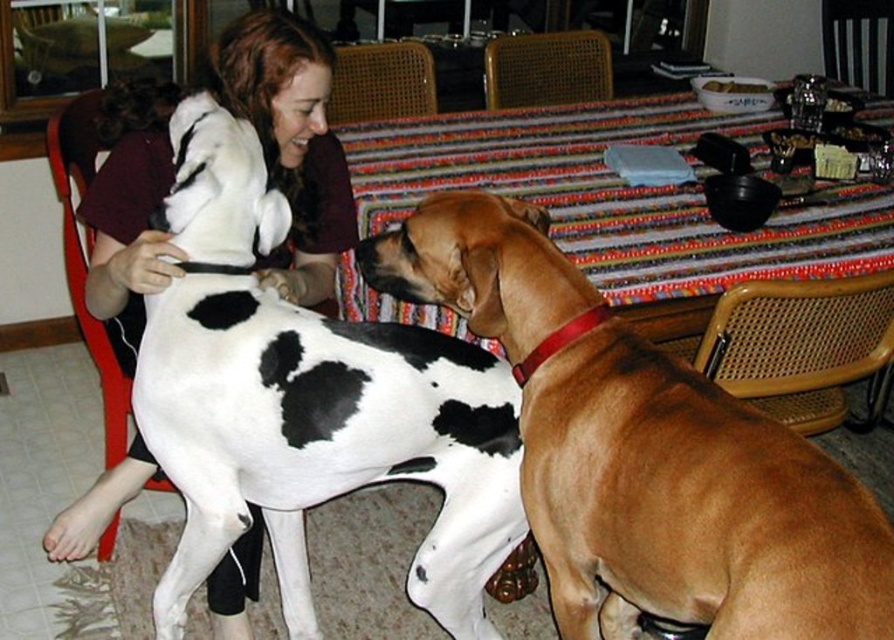
Is white-spotted fur dog at center smaller than matte black shirt at upper left?

No, white-spotted fur dog at center is not smaller than matte black shirt at upper left.

Between white-spotted fur dog at center and matte black shirt at upper left, which one has more height?

white-spotted fur dog at center

Is point (196, 394) farther from camera compared to point (285, 148)?

No, (196, 394) is in front of (285, 148).

This screenshot has width=894, height=640. Find the location of `white-spotted fur dog at center`. white-spotted fur dog at center is located at coordinates (308, 403).

Does striped fabric table at center have a larger size compared to matte black shirt at upper left?

Answer: Yes.

Does point (833, 195) come behind point (233, 74)?

Yes, it is.

The width and height of the screenshot is (894, 640). I want to click on striped fabric table at center, so click(628, 195).

Who is positioned more to the left, matte black shirt at upper left or braided wood chair at lower right?

From the viewer's perspective, matte black shirt at upper left appears more on the left side.

Who is lower down, matte black shirt at upper left or braided wood chair at lower right?

braided wood chair at lower right is lower down.

Locate an element on the screen. The height and width of the screenshot is (640, 894). matte black shirt at upper left is located at coordinates (291, 141).

Image resolution: width=894 pixels, height=640 pixels. In order to click on matte black shirt at upper left in this screenshot , I will do click(x=291, y=141).